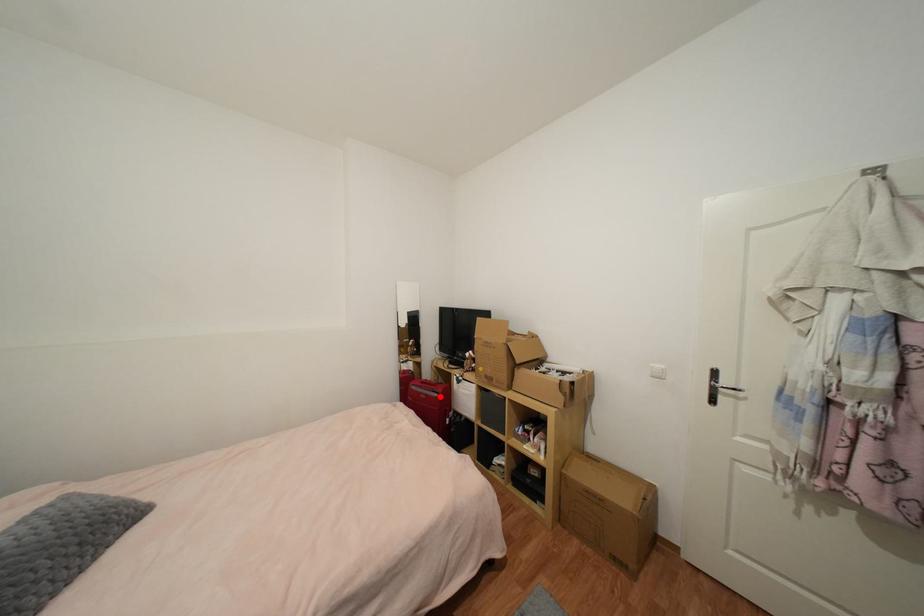
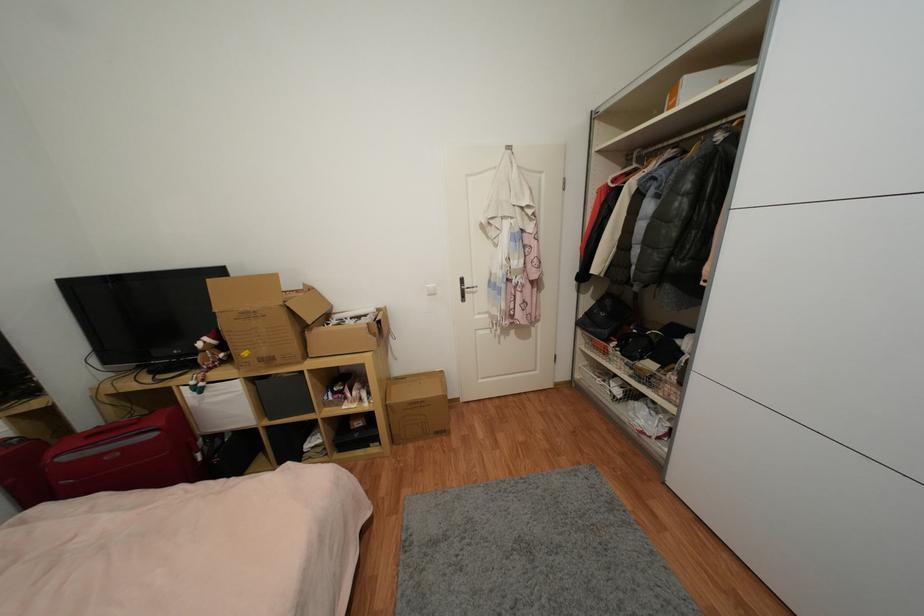
Question: I am providing you with two images of the same scene from different viewpoints. Image1 has a red point marked. In image2, the corresponding 3D location appears at what relative position? Reply with the corresponding letter.

Choices:
 (A) Closer
 (B) Farther

Answer: (A)